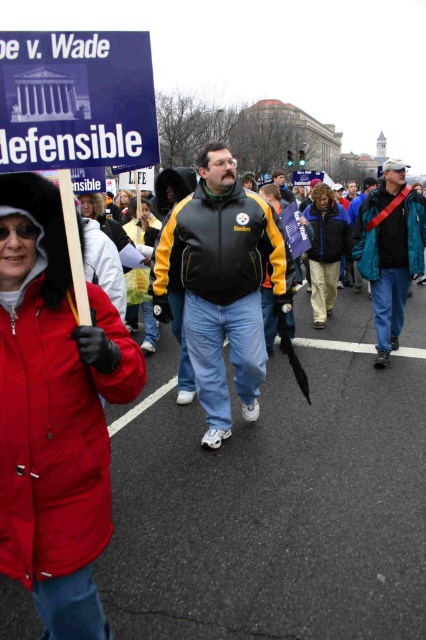
You are a photographer trying to capture a clear photo of both the khaki pants at center and the yellow fabric jacket at center. Based on their sizes, which one should you focus on first to ensure it fits in the frame?

The khaki pants at center is much taller than the yellow fabric jacket at center, so you should focus on the khaki pants at center first to ensure it fits in the frame.

You are a photographer at the demonstration. You want to take a photo that includes both the blue paper sign at upper left and the khaki pants at center. Which object should you focus on first to ensure both are in frame?

The blue paper sign at upper left is smaller than the khaki pants at center, so you should focus on the khaki pants at center first to ensure both are in frame.